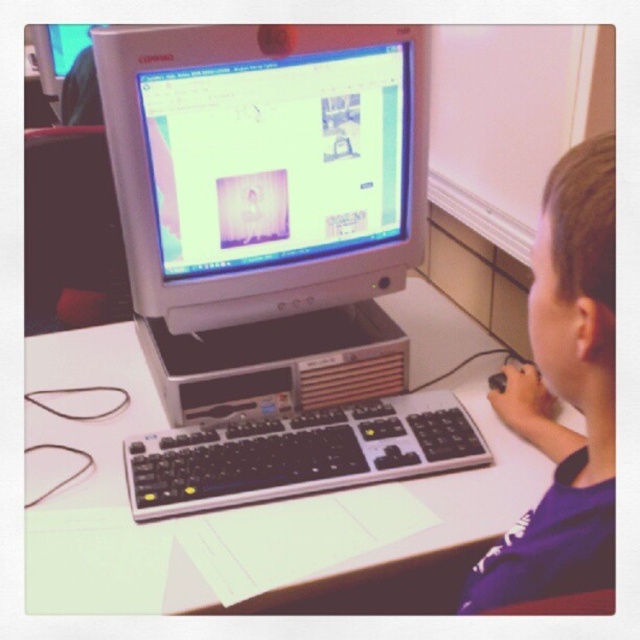
Is point (390, 208) positioned before point (72, 51)?

Yes, it is in front of point (72, 51).

Does matte silver monitor at center lie in front of matte black monitor at upper left?

That is True.

Is point (243, 328) positioned after point (70, 64)?

No, (243, 328) is in front of (70, 64).

The image size is (640, 640). I want to click on matte silver monitor at center, so click(x=268, y=205).

Between black plastic keyboard at center and matte black monitor at upper left, which one has more height?

With more height is matte black monitor at upper left.

This screenshot has height=640, width=640. What do you see at coordinates (300, 454) in the screenshot?
I see `black plastic keyboard at center` at bounding box center [300, 454].

This screenshot has height=640, width=640. I want to click on black plastic keyboard at center, so click(300, 454).

Who is lower down, white plastic table at center or black plastic keyboard at center?

black plastic keyboard at center

Which of these two, white plastic table at center or black plastic keyboard at center, stands shorter?

With less height is black plastic keyboard at center.

You are a GUI agent. You are given a task and a screenshot of the screen. Output one action in this format:
    pyautogui.click(x=<x>, y=<y>)
    Task: Click on the white plastic table at center
    The height and width of the screenshot is (640, 640).
    Given the screenshot: What is the action you would take?
    pyautogui.click(x=234, y=509)